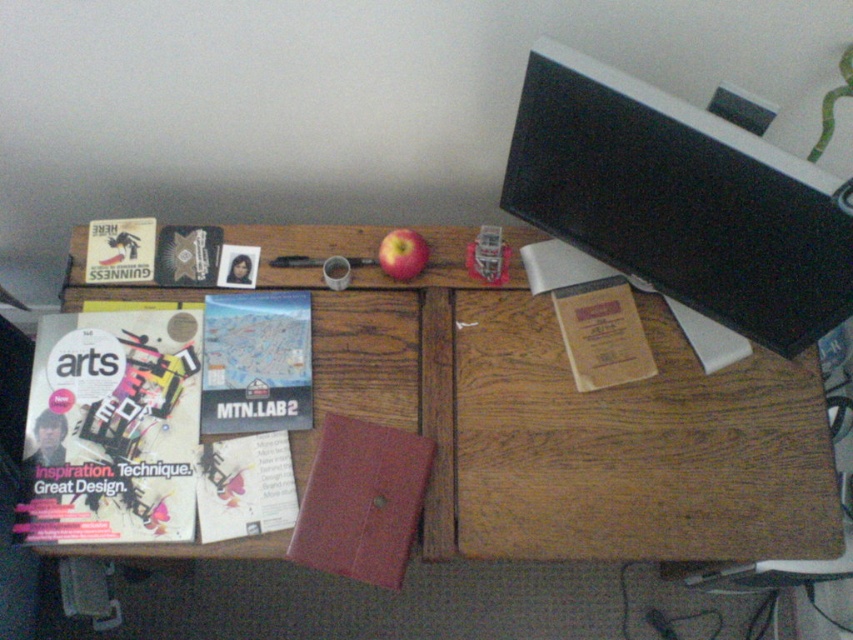
Question: Is wooden desk at center closer to the viewer compared to red matte apple at center?

Choices:
 (A) no
 (B) yes

Answer: (B)

Question: Can you confirm if wooden desk at center is positioned below metallic silver magazine at upper left?

Choices:
 (A) no
 (B) yes

Answer: (B)

Question: Which is nearer to the red matte apple at center?

Choices:
 (A) leather-bound book at center
 (B) matte paper magazine at left
 (C) metallic silver magazine at upper left

Answer: (C)

Question: Which object appears farthest from the camera in this image?

Choices:
 (A) leather-bound book at center
 (B) matte paper magazine at center
 (C) matte paper map at center

Answer: (C)

Question: Considering the relative positions of matte brown book at upper right and matte black book at upper left in the image provided, where is matte brown book at upper right located with respect to matte black book at upper left?

Choices:
 (A) above
 (B) below

Answer: (B)

Question: Based on their relative distances, which object is nearer to the matte black book at upper left?

Choices:
 (A) matte paper map at center
 (B) red matte apple at center

Answer: (A)